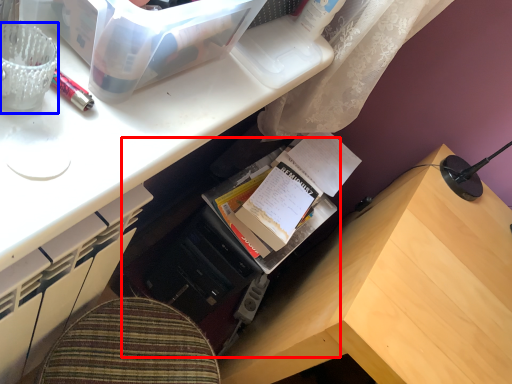
Question: Which object appears farthest to the camera in this image, bookshelf (highlighted by a red box) or stationery (highlighted by a blue box)?

Choices:
 (A) bookshelf
 (B) stationery

Answer: (A)